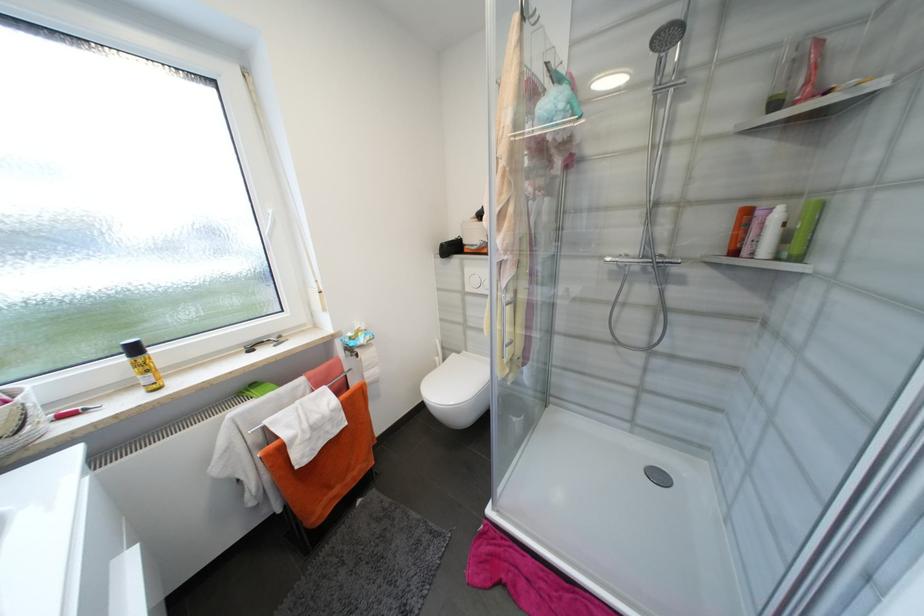
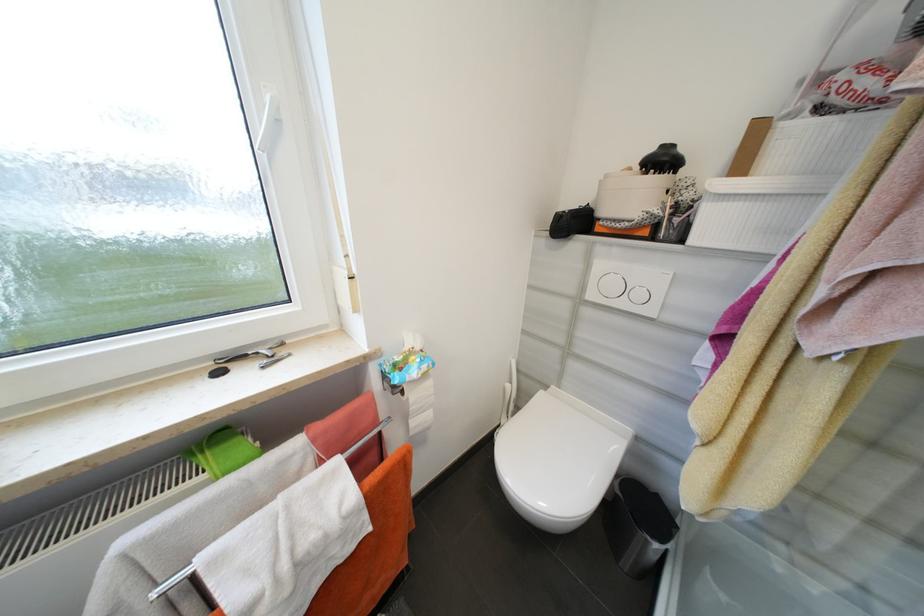
Which direction would the cameraman need to move to produce the second image?

The cameraman walked toward left, forward.